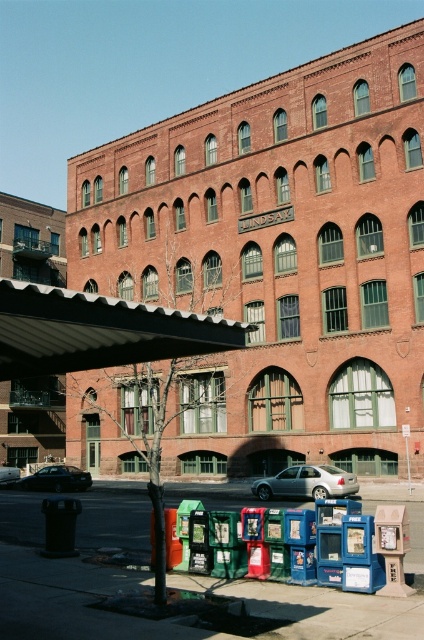
Question: Among these objects, which one is nearest to the camera?

Choices:
 (A) shiny black sedan at center
 (B) white corrugated awning at center
 (C) silver metallic sedan at center

Answer: (B)

Question: Does silver metallic sedan at center appear under shiny black sedan at center?

Choices:
 (A) no
 (B) yes

Answer: (A)

Question: Based on their relative distances, which object is nearer to the white corrugated awning at center?

Choices:
 (A) silver metallic sedan at center
 (B) shiny black sedan at center

Answer: (A)

Question: Which object is the farthest from the shiny black sedan at center?

Choices:
 (A) white corrugated awning at center
 (B) silver metallic sedan at center

Answer: (A)

Question: Does silver metallic sedan at center have a smaller size compared to shiny black sedan at center?

Choices:
 (A) no
 (B) yes

Answer: (B)

Question: Is silver metallic sedan at center bigger than shiny black sedan at center?

Choices:
 (A) no
 (B) yes

Answer: (A)